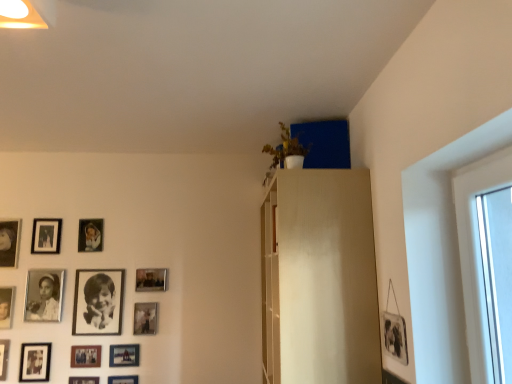
At what (x,y) coordinates should I click in order to perform the action: click on black paper picture frame at upper left, which is the fifth picture frame from right to left. Please return your answer as a coordinate pair (x, y). Looking at the image, I should click on (98, 302).

Measure the distance between point (133, 378) and camera.

The depth of point (133, 378) is 8.56 feet.

What do you see at coordinates (83, 380) in the screenshot? The image size is (512, 384). I see `matte black picture frame at lower left, the 7th picture frame when ordered from right to left` at bounding box center [83, 380].

Find the location of a particular element. matte black picture frame at upper left, marked as the 5th picture frame in a left-to-right arrangement is located at coordinates (46, 236).

What do you see at coordinates (4, 357) in the screenshot? This screenshot has height=384, width=512. I see `matte black picture frame at lower left, which is counted as the 12th picture frame, starting from the right` at bounding box center [4, 357].

How much space does matte black picture frame at upper left, which is the 7th picture frame from left to right, occupy horizontally?

matte black picture frame at upper left, which is the 7th picture frame from left to right, is 0.79 inches wide.

The image size is (512, 384). I want to click on matte black picture frame at upper left, which is the 7th picture frame from left to right, so pos(90,235).

Identify the location of metallic silver picture frame at lower center, which is counted as the fourth picture frame, starting from the right. (124, 355).

Is matte black picture frame at lower center, the third picture frame viewed from the right, bigger than black matte photo frame at left, arranged as the first picture frame when viewed from the left?

No, matte black picture frame at lower center, the third picture frame viewed from the right, is not bigger than black matte photo frame at left, arranged as the first picture frame when viewed from the left.

Looking at this image, is matte black picture frame at lower center, the twelfth picture frame when ordered from left to right, shorter than black matte photo frame at left, arranged as the first picture frame when viewed from the left?

Correct, matte black picture frame at lower center, the twelfth picture frame when ordered from left to right, is not as tall as black matte photo frame at left, arranged as the first picture frame when viewed from the left.

Identify the location of the 11th picture frame to the right of the black matte photo frame at left, arranged as the first picture frame when viewed from the left, counting from the anchor's position. (123, 379).

Is matte black picture frame at upper left, arranged as the 10th picture frame when viewed from the right, oriented towards matte black picture frame at lower center, the twelfth picture frame when ordered from left to right?

No, matte black picture frame at upper left, arranged as the 10th picture frame when viewed from the right, is not aimed at matte black picture frame at lower center, the twelfth picture frame when ordered from left to right.

From a real-world perspective, who is located higher, matte black picture frame at upper left, marked as the 5th picture frame in a left-to-right arrangement, or matte black picture frame at lower center, the twelfth picture frame when ordered from left to right?

In real-world perspective, matte black picture frame at upper left, marked as the 5th picture frame in a left-to-right arrangement, is above.

Between matte black picture frame at upper left, arranged as the 10th picture frame when viewed from the right, and matte black picture frame at lower center, the twelfth picture frame when ordered from left to right, which one has larger width?

With larger width is matte black picture frame at upper left, arranged as the 10th picture frame when viewed from the right.

Which point is more forward, (x=60, y=230) or (x=135, y=377)?

Positioned in front is point (x=135, y=377).

Would you consider matte black photo frame at lower left, the thirteenth picture frame from the right, to be distant from matte black picture frame at upper left, arranged as the 10th picture frame when viewed from the right?

No, matte black photo frame at lower left, the thirteenth picture frame from the right, is in close proximity to matte black picture frame at upper left, arranged as the 10th picture frame when viewed from the right.

From a real-world perspective, is matte black photo frame at lower left, the thirteenth picture frame from the right, located beneath matte black picture frame at upper left, arranged as the 10th picture frame when viewed from the right?

Indeed, from a real-world perspective, matte black photo frame at lower left, the thirteenth picture frame from the right, is positioned beneath matte black picture frame at upper left, arranged as the 10th picture frame when viewed from the right.

Is matte black photo frame at lower left, the thirteenth picture frame from the right, to the right of matte black picture frame at upper left, marked as the 5th picture frame in a left-to-right arrangement, from the viewer's perspective?

No, matte black photo frame at lower left, the thirteenth picture frame from the right, is not to the right of matte black picture frame at upper left, marked as the 5th picture frame in a left-to-right arrangement.

Between matte black photo frame at lower left, the thirteenth picture frame from the right, and matte black picture frame at upper left, arranged as the 10th picture frame when viewed from the right, which one has more height?

Standing taller between the two is matte black photo frame at lower left, the thirteenth picture frame from the right.

From a real-world perspective, count 6th picture frames downward from the matte silver picture frame at lower center, the 13th picture frame from the left, and point to it. Please provide its 2D coordinates.

[(123, 379)]

Considering the sizes of objects matte silver picture frame at lower center, the 13th picture frame from the left, and matte black picture frame at lower center, the third picture frame viewed from the right, in the image provided, who is shorter, matte silver picture frame at lower center, the 13th picture frame from the left, or matte black picture frame at lower center, the third picture frame viewed from the right,?

matte black picture frame at lower center, the third picture frame viewed from the right, is shorter.

Looking at the image, does matte silver picture frame at lower center, which is the second picture frame from right to left, seem bigger or smaller compared to matte black picture frame at lower center, the twelfth picture frame when ordered from left to right?

matte silver picture frame at lower center, which is the second picture frame from right to left, is bigger than matte black picture frame at lower center, the twelfth picture frame when ordered from left to right.

Looking at this image, considering the positions of objects matte silver picture frame at lower center, which is the second picture frame from right to left, and matte black picture frame at lower center, the third picture frame viewed from the right, in the image provided, who is in front, matte silver picture frame at lower center, which is the second picture frame from right to left, or matte black picture frame at lower center, the third picture frame viewed from the right,?

matte black picture frame at lower center, the third picture frame viewed from the right.

Between matte black picture frame at lower left, acting as the eighth picture frame starting from the left, and metallic silver picture frame at lower center, the 14th picture frame in the left-to-right sequence, which one has more height?

With more height is metallic silver picture frame at lower center, the 14th picture frame in the left-to-right sequence.

Which of these two, matte black picture frame at lower left, the 7th picture frame when ordered from right to left, or metallic silver picture frame at lower center, the 14th picture frame in the left-to-right sequence, is thinner?

With smaller width is matte black picture frame at lower left, the 7th picture frame when ordered from right to left.

Based on the photo, choose the correct answer: Is matte black picture frame at lower left, acting as the eighth picture frame starting from the left, inside metallic silver picture frame at lower center, the 14th picture frame in the left-to-right sequence, or outside it?

matte black picture frame at lower left, acting as the eighth picture frame starting from the left, exists outside the volume of metallic silver picture frame at lower center, the 14th picture frame in the left-to-right sequence.

Would you say matte black picture frame at lower left, acting as the eighth picture frame starting from the left, is a long distance from metallic silver picture frame at lower center, placed as the first picture frame when sorted from right to left?

No, matte black picture frame at lower left, acting as the eighth picture frame starting from the left, is not far away from metallic silver picture frame at lower center, placed as the first picture frame when sorted from right to left.

Can you tell me how much matte black picture frame at lower left, arranged as the 9th picture frame when viewed from the left, and matte black picture frame at lower left, which is the third picture frame from left to right, differ in facing direction?

0.00707 degrees.

From a real-world perspective, is matte black picture frame at lower left, arranged as the 9th picture frame when viewed from the left, physically located above or below matte black picture frame at lower left, which is the third picture frame from left to right?

matte black picture frame at lower left, arranged as the 9th picture frame when viewed from the left, is situated higher than matte black picture frame at lower left, which is the third picture frame from left to right, in the real world.

From the image's perspective, is matte black picture frame at lower left, arranged as the 9th picture frame when viewed from the left, above or below matte black picture frame at lower left, which is counted as the 12th picture frame, starting from the right?

Based on their image positions, matte black picture frame at lower left, arranged as the 9th picture frame when viewed from the left, is located above matte black picture frame at lower left, which is counted as the 12th picture frame, starting from the right.

Between matte black picture frame at lower left, the 6th picture frame in the right-to-left sequence, and matte black picture frame at lower left, which is counted as the 12th picture frame, starting from the right, which one has more height?

matte black picture frame at lower left, which is counted as the 12th picture frame, starting from the right.

How many degrees apart are the facing directions of black paper picture frame at upper left, positioned as the tenth picture frame in left-to-right order, and matte black picture frame at lower left, arranged as the 9th picture frame when viewed from the left?

The angular difference between black paper picture frame at upper left, positioned as the tenth picture frame in left-to-right order, and matte black picture frame at lower left, arranged as the 9th picture frame when viewed from the left, is 0.083 degrees.

Is black paper picture frame at upper left, positioned as the tenth picture frame in left-to-right order, next to matte black picture frame at lower left, arranged as the 9th picture frame when viewed from the left, and touching it?

No, black paper picture frame at upper left, positioned as the tenth picture frame in left-to-right order, is not touching matte black picture frame at lower left, arranged as the 9th picture frame when viewed from the left.

Considering the relative sizes of black paper picture frame at upper left, positioned as the tenth picture frame in left-to-right order, and matte black picture frame at lower left, arranged as the 9th picture frame when viewed from the left, in the image provided, is black paper picture frame at upper left, positioned as the tenth picture frame in left-to-right order, smaller than matte black picture frame at lower left, arranged as the 9th picture frame when viewed from the left,?

Actually, black paper picture frame at upper left, positioned as the tenth picture frame in left-to-right order, might be larger than matte black picture frame at lower left, arranged as the 9th picture frame when viewed from the left.

Is point (111, 314) more distant than point (97, 361)?

Yes, point (111, 314) is behind point (97, 361).

Identify the location of the 11th picture frame located beneath the black matte photo frame at left, arranged as the first picture frame when viewed from the left (from a real-world perspective). (123, 379).

There is a matte black picture frame at lower center, the twelfth picture frame when ordered from left to right. Where is `the 12th picture frame above it (from the image's perspective)`? the 12th picture frame above it (from the image's perspective) is located at coordinates (46, 236).

Estimate the real-world distances between objects in this image. Which object is further from matte wood dresser at upper center, matte black photo frame at lower left, the thirteenth picture frame from the right, or black matte picture frame at lower left, positioned as the 4th picture frame in left-to-right order?

The object further to matte wood dresser at upper center is matte black photo frame at lower left, the thirteenth picture frame from the right.

When comparing their distances from matte black photo frame at lower left, marked as the 2th picture frame in a left-to-right arrangement, does matte black picture frame at lower center, the twelfth picture frame when ordered from left to right, or matte black picture frame at lower left, arranged as the 9th picture frame when viewed from the left, seem closer?

The object closer to matte black photo frame at lower left, marked as the 2th picture frame in a left-to-right arrangement, is matte black picture frame at lower left, arranged as the 9th picture frame when viewed from the left.

Looking at this image, which object lies further to the anchor point matte black picture frame at lower left, which is counted as the 12th picture frame, starting from the right, matte black picture frame at lower left, the 7th picture frame when ordered from right to left, or matte black picture frame at lower center, the twelfth picture frame when ordered from left to right?

matte black picture frame at lower center, the twelfth picture frame when ordered from left to right, is positioned further to the anchor matte black picture frame at lower left, which is counted as the 12th picture frame, starting from the right.

Based on their spatial positions, is matte black picture frame at lower left, acting as the eighth picture frame starting from the left, or metallic silver picture frame at lower center, which is counted as the fourth picture frame, starting from the right, closer to matte black photo frame at lower left, the thirteenth picture frame from the right?

Among the two, matte black picture frame at lower left, acting as the eighth picture frame starting from the left, is located nearer to matte black photo frame at lower left, the thirteenth picture frame from the right.

When comparing their distances from black matte picture frame at lower left, positioned as the 4th picture frame in left-to-right order, does matte silver picture frame at lower center, the 13th picture frame from the left, or matte black picture frame at lower left, the 6th picture frame in the right-to-left sequence, seem closer?

Based on the image, matte black picture frame at lower left, the 6th picture frame in the right-to-left sequence, appears to be nearer to black matte picture frame at lower left, positioned as the 4th picture frame in left-to-right order.

Estimate the real-world distances between objects in this image. Which object is further from black matte photo frame at lower left, which is the sixth picture frame from left to right, matte black picture frame at lower left, the 6th picture frame in the right-to-left sequence, or metallic silver picture frame at lower center, which is counted as the fourth picture frame, starting from the right?

The object further to black matte photo frame at lower left, which is the sixth picture frame from left to right, is metallic silver picture frame at lower center, which is counted as the fourth picture frame, starting from the right.

Considering their positions, is black matte photo frame at lower left, the 9th picture frame positioned from the right, positioned closer to metallic silver picture frame at lower center, which is counted as the fourth picture frame, starting from the right, than matte black picture frame at lower left, which is the third picture frame from left to right?

black matte photo frame at lower left, the 9th picture frame positioned from the right, is positioned closer to the anchor metallic silver picture frame at lower center, which is counted as the fourth picture frame, starting from the right.

From the image, which object appears to be nearer to black matte photo frame at left, arranged as the 14th picture frame when viewed from the right, matte silver picture frame at lower center, which is the second picture frame from right to left, or matte black picture frame at lower center, the third picture frame viewed from the right?

matte silver picture frame at lower center, which is the second picture frame from right to left, is closer to black matte photo frame at left, arranged as the 14th picture frame when viewed from the right.